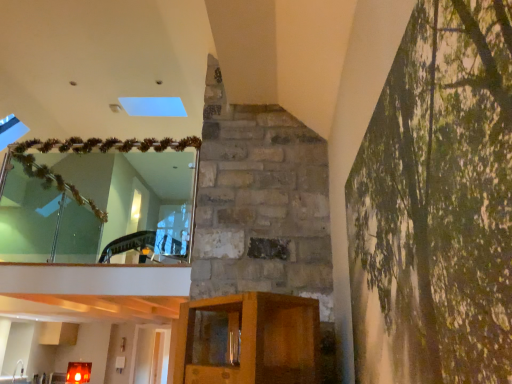
Question: Would you say brushed metal sink at lower left is a long distance from clear glass mirror at upper left?

Choices:
 (A) yes
 (B) no

Answer: (A)

Question: Is clear glass mirror at upper left located within brushed metal sink at lower left?

Choices:
 (A) yes
 (B) no

Answer: (B)

Question: Can you confirm if brushed metal sink at lower left is wider than clear glass mirror at upper left?

Choices:
 (A) yes
 (B) no

Answer: (A)

Question: Can you confirm if brushed metal sink at lower left is taller than clear glass mirror at upper left?

Choices:
 (A) no
 (B) yes

Answer: (A)

Question: Does brushed metal sink at lower left turn towards clear glass mirror at upper left?

Choices:
 (A) yes
 (B) no

Answer: (B)

Question: Considering the relative sizes of brushed metal sink at lower left and clear glass mirror at upper left in the image provided, is brushed metal sink at lower left bigger than clear glass mirror at upper left?

Choices:
 (A) yes
 (B) no

Answer: (B)

Question: Does green textured canvas at right lie behind clear glass mirror at upper left?

Choices:
 (A) yes
 (B) no

Answer: (B)

Question: Is green textured canvas at right bigger than clear glass mirror at upper left?

Choices:
 (A) no
 (B) yes

Answer: (A)

Question: Is green textured canvas at right shorter than clear glass mirror at upper left?

Choices:
 (A) no
 (B) yes

Answer: (B)

Question: Does green textured canvas at right have a smaller size compared to clear glass mirror at upper left?

Choices:
 (A) yes
 (B) no

Answer: (A)

Question: Can you confirm if green textured canvas at right is positioned to the right of clear glass mirror at upper left?

Choices:
 (A) yes
 (B) no

Answer: (A)

Question: From the image's perspective, is green textured canvas at right located beneath clear glass mirror at upper left?

Choices:
 (A) no
 (B) yes

Answer: (B)

Question: Is clear glass mirror at upper left aimed at green textured canvas at right?

Choices:
 (A) no
 (B) yes

Answer: (A)